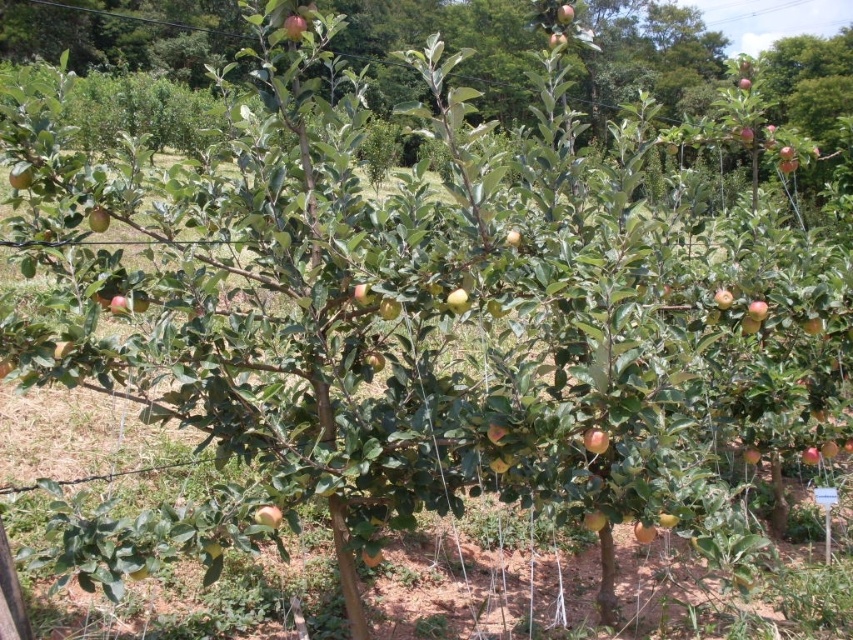
Question: From the image, what is the correct spatial relationship of shiny red apple at center in relation to green matte apple at center?

Choices:
 (A) right
 (B) left

Answer: (A)

Question: Which of the following is the farthest from the observer?

Choices:
 (A) green matte apple at center
 (B) shiny red apple at center

Answer: (B)

Question: Is shiny red apple at center bigger than green matte apple at center?

Choices:
 (A) no
 (B) yes

Answer: (B)

Question: Which of the following is the farthest from the observer?

Choices:
 (A) shiny red apple at center
 (B) green matte apple at center

Answer: (A)

Question: Can you confirm if shiny red apple at center is positioned to the left of green matte apple at center?

Choices:
 (A) yes
 (B) no

Answer: (B)